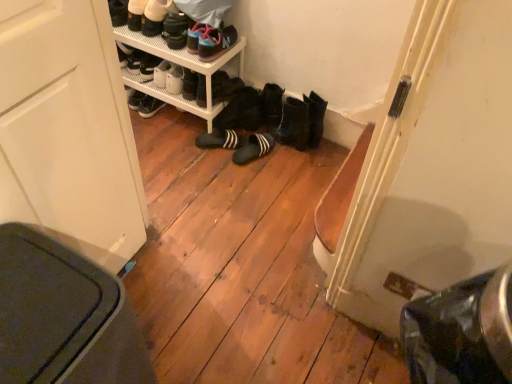
I want to click on matte black shoes at center, marked as the 4th footwear in a top-to-bottom arrangement, so click(x=174, y=80).

At what (x,y) coordinates should I click in order to perform the action: click on matte black shoes at upper center, the 2th footwear from the top. Please return your answer as a coordinate pair (x, y). Image resolution: width=512 pixels, height=384 pixels. Looking at the image, I should click on (176, 30).

Locate an element on the screen. The width and height of the screenshot is (512, 384). white plastic shelf at upper center is located at coordinates (182, 66).

Locate an element on the screen. The height and width of the screenshot is (384, 512). black suede slippers at center, arranged as the 7th footwear when viewed from the top is located at coordinates (253, 148).

Identify the location of black suede slippers at center, marked as the 6th footwear in a top-to-bottom arrangement. The width and height of the screenshot is (512, 384). (220, 140).

What is the approximate height of black rubber boots at center, the third footwear positioned from the bottom?

8.55 inches.

Find the location of a particular element. matte black sneakers at upper center, marked as the 5th footwear in a bottom-to-top arrangement is located at coordinates (216, 42).

Is point (167, 45) positioned after point (215, 139)?

No, (167, 45) is in front of (215, 139).

Considering the sizes of matte black shoes at upper center, the 2th footwear from the top, and black suede slippers at center, marked as the 6th footwear in a top-to-bottom arrangement, in the image, is matte black shoes at upper center, the 2th footwear from the top, bigger or smaller than black suede slippers at center, marked as the 6th footwear in a top-to-bottom arrangement,?

Clearly, matte black shoes at upper center, the 2th footwear from the top, is smaller in size than black suede slippers at center, marked as the 6th footwear in a top-to-bottom arrangement.

From the black suede slippers at center, marked as the 6th footwear in a top-to-bottom arrangement, count the 1st footwear to the left and point to it. Please provide its 2D coordinates.

[(176, 30)]

Which is in front, matte black sneakers at upper center, marked as the 5th footwear in a bottom-to-top arrangement, or white leather shoes at upper left, which is counted as the seventh footwear, starting from the bottom?

matte black sneakers at upper center, marked as the 5th footwear in a bottom-to-top arrangement.

From the image's perspective, is matte black sneakers at upper center, marked as the 5th footwear in a bottom-to-top arrangement, located beneath white leather shoes at upper left, which ranks as the first footwear in top-to-bottom order?

Correct, matte black sneakers at upper center, marked as the 5th footwear in a bottom-to-top arrangement, appears lower than white leather shoes at upper left, which ranks as the first footwear in top-to-bottom order, in the image.

Considering the points (208, 39) and (155, 29), which point is in front, point (208, 39) or point (155, 29)?

The point (208, 39) is in front.

Would you say black suede slippers at center, marked as the 6th footwear in a top-to-bottom arrangement, contains black suede slippers at center, placed as the 1th footwear when sorted from bottom to top?

Actually, black suede slippers at center, placed as the 1th footwear when sorted from bottom to top, is outside black suede slippers at center, marked as the 6th footwear in a top-to-bottom arrangement.

From a real-world perspective, which is physically above, black suede slippers at center, marked as the 6th footwear in a top-to-bottom arrangement, or black suede slippers at center, arranged as the 7th footwear when viewed from the top?

In real-world perspective, black suede slippers at center, marked as the 6th footwear in a top-to-bottom arrangement, is above.

Is black suede slippers at center, arranged as the 7th footwear when viewed from the top, at the back of black suede slippers at center, the second footwear positioned from the bottom?

black suede slippers at center, the second footwear positioned from the bottom, is not turned away from black suede slippers at center, arranged as the 7th footwear when viewed from the top.

In the scene shown: How different are the orientations of black suede slippers at center, marked as the 6th footwear in a top-to-bottom arrangement, and black suede slippers at center, placed as the 1th footwear when sorted from bottom to top, in degrees?

The angle between the facing direction of black suede slippers at center, marked as the 6th footwear in a top-to-bottom arrangement, and the facing direction of black suede slippers at center, placed as the 1th footwear when sorted from bottom to top, is 34.6 degrees.

Looking at this image, who is smaller, matte black shoes at center, marked as the 4th footwear in a top-to-bottom arrangement, or black rubber boots at center, arranged as the 5th footwear when viewed from the top?

Smaller between the two is matte black shoes at center, marked as the 4th footwear in a top-to-bottom arrangement.

Is matte black shoes at center, arranged as the fourth footwear when ordered from the bottom, next to black rubber boots at center, the third footwear positioned from the bottom?

No, matte black shoes at center, arranged as the fourth footwear when ordered from the bottom, is not next to black rubber boots at center, the third footwear positioned from the bottom.

Considering the positions of objects matte black shoes at center, marked as the 4th footwear in a top-to-bottom arrangement, and black rubber boots at center, the third footwear positioned from the bottom, in the image provided, who is behind, matte black shoes at center, marked as the 4th footwear in a top-to-bottom arrangement, or black rubber boots at center, the third footwear positioned from the bottom,?

matte black shoes at center, marked as the 4th footwear in a top-to-bottom arrangement, is more distant.

Looking at their sizes, would you say matte black shoes at center, arranged as the fourth footwear when ordered from the bottom, is wider or thinner than black rubber boots at center, arranged as the 5th footwear when viewed from the top?

Considering their sizes, matte black shoes at center, arranged as the fourth footwear when ordered from the bottom, looks slimmer than black rubber boots at center, arranged as the 5th footwear when viewed from the top.

Can you confirm if black rubber boots at center, arranged as the 5th footwear when viewed from the top, is shorter than white plastic shelf at upper center?

Indeed, black rubber boots at center, arranged as the 5th footwear when viewed from the top, has a lesser height compared to white plastic shelf at upper center.

Considering the relative sizes of black rubber boots at center, the third footwear positioned from the bottom, and white plastic shelf at upper center in the image provided, is black rubber boots at center, the third footwear positioned from the bottom, smaller than white plastic shelf at upper center?

Correct, black rubber boots at center, the third footwear positioned from the bottom, occupies less space than white plastic shelf at upper center.

Is black rubber boots at center, the third footwear positioned from the bottom, spatially inside white plastic shelf at upper center, or outside of it?

black rubber boots at center, the third footwear positioned from the bottom, exists outside the volume of white plastic shelf at upper center.

Identify the location of the 1st footwear directly beneath the white plastic shelf at upper center (from a real-world perspective). This screenshot has height=384, width=512. (241, 111).

How many degrees apart are the facing directions of black suede slippers at center, placed as the 1th footwear when sorted from bottom to top, and matte black shoes at upper center, which is the 6th footwear from bottom to top?

They differ by 63.9 degrees in their facing directions.

You are a GUI agent. You are given a task and a screenshot of the screen. Output one action in this format:
    pyautogui.click(x=<x>, y=<y>)
    Task: Click on the 4th footwear positioned above the black suede slippers at center, placed as the 1th footwear when sorted from bottom to top (from a real-world perspective)
    Image resolution: width=512 pixels, height=384 pixels.
    Given the screenshot: What is the action you would take?
    pyautogui.click(x=176, y=30)

Is black suede slippers at center, arranged as the 7th footwear when viewed from the top, aimed at matte black shoes at upper center, the 2th footwear from the top?

No, black suede slippers at center, arranged as the 7th footwear when viewed from the top, is not oriented towards matte black shoes at upper center, the 2th footwear from the top.

Who is smaller, black suede slippers at center, arranged as the 7th footwear when viewed from the top, or matte black shoes at upper center, the 2th footwear from the top?

Smaller between the two is matte black shoes at upper center, the 2th footwear from the top.

Considering the relative positions of black rubber boots at center, arranged as the 5th footwear when viewed from the top, and matte black sneakers at upper center, the 3th footwear from the top, in the image provided, is black rubber boots at center, arranged as the 5th footwear when viewed from the top, to the right of matte black sneakers at upper center, the 3th footwear from the top, from the viewer's perspective?

Yes, black rubber boots at center, arranged as the 5th footwear when viewed from the top, is to the right of matte black sneakers at upper center, the 3th footwear from the top.

Are black rubber boots at center, the third footwear positioned from the bottom, and matte black sneakers at upper center, marked as the 5th footwear in a bottom-to-top arrangement, beside each other?

black rubber boots at center, the third footwear positioned from the bottom, and matte black sneakers at upper center, marked as the 5th footwear in a bottom-to-top arrangement, are clearly separated.

Based on the photo, which of these two, black rubber boots at center, the third footwear positioned from the bottom, or matte black sneakers at upper center, marked as the 5th footwear in a bottom-to-top arrangement, stands shorter?

With less height is matte black sneakers at upper center, marked as the 5th footwear in a bottom-to-top arrangement.

Where is `the 4th footwear behind the matte black shoes at upper center, the 2th footwear from the top`? The image size is (512, 384). the 4th footwear behind the matte black shoes at upper center, the 2th footwear from the top is located at coordinates (220, 140).

At what (x,y) coordinates should I click in order to perform the action: click on the 4th footwear to the right when counting from the white leather shoes at upper left, which ranks as the first footwear in top-to-bottom order. Please return your answer as a coordinate pair (x, y). This screenshot has height=384, width=512. Looking at the image, I should click on (216, 42).

Estimate the real-world distances between objects in this image. Which object is further from matte black sneakers at upper center, the 3th footwear from the top, black suede slippers at center, marked as the 6th footwear in a top-to-bottom arrangement, or white plastic shelf at upper center?

black suede slippers at center, marked as the 6th footwear in a top-to-bottom arrangement.

From the image, which object appears to be nearer to white plastic shelf at upper center, matte black sneakers at upper center, marked as the 5th footwear in a bottom-to-top arrangement, or matte black shoes at center, marked as the 4th footwear in a top-to-bottom arrangement?

matte black shoes at center, marked as the 4th footwear in a top-to-bottom arrangement, is closer to white plastic shelf at upper center.

Which object lies further to the anchor point white leather shoes at upper left, which is counted as the seventh footwear, starting from the bottom, matte black shoes at center, marked as the 4th footwear in a top-to-bottom arrangement, or matte black shoes at upper center, the 2th footwear from the top?

matte black shoes at center, marked as the 4th footwear in a top-to-bottom arrangement, lies further to white leather shoes at upper left, which is counted as the seventh footwear, starting from the bottom, than the other object.

Considering their positions, is black suede slippers at center, placed as the 1th footwear when sorted from bottom to top, positioned further to white plastic shelf at upper center than black rubber boots at center, the third footwear positioned from the bottom?

black suede slippers at center, placed as the 1th footwear when sorted from bottom to top, is positioned further to the anchor white plastic shelf at upper center.

When comparing their distances from black rubber boots at center, the third footwear positioned from the bottom, does black suede slippers at center, placed as the 1th footwear when sorted from bottom to top, or white plastic shelf at upper center seem closer?

The object closer to black rubber boots at center, the third footwear positioned from the bottom, is black suede slippers at center, placed as the 1th footwear when sorted from bottom to top.

Looking at the image, which one is located further to matte black shoes at center, arranged as the fourth footwear when ordered from the bottom, black suede slippers at center, arranged as the 7th footwear when viewed from the top, or black rubber boots at center, the third footwear positioned from the bottom?

The object further to matte black shoes at center, arranged as the fourth footwear when ordered from the bottom, is black suede slippers at center, arranged as the 7th footwear when viewed from the top.

Estimate the real-world distances between objects in this image. Which object is further from black rubber boots at center, the third footwear positioned from the bottom, black suede slippers at center, placed as the 1th footwear when sorted from bottom to top, or white leather shoes at upper left, which ranks as the first footwear in top-to-bottom order?

white leather shoes at upper left, which ranks as the first footwear in top-to-bottom order, is further to black rubber boots at center, the third footwear positioned from the bottom.

Based on their spatial positions, is black rubber boots at center, arranged as the 5th footwear when viewed from the top, or black suede slippers at center, placed as the 1th footwear when sorted from bottom to top, further from white leather shoes at upper left, which ranks as the first footwear in top-to-bottom order?

Among the two, black suede slippers at center, placed as the 1th footwear when sorted from bottom to top, is located further to white leather shoes at upper left, which ranks as the first footwear in top-to-bottom order.

Identify the location of shelf between white leather shoes at upper left, which is counted as the seventh footwear, starting from the bottom, and black suede slippers at center, marked as the 6th footwear in a top-to-bottom arrangement, from top to bottom. (182, 66).

Locate an element on the screen. The image size is (512, 384). shelf that lies between matte black shoes at upper center, the 2th footwear from the top, and black suede slippers at center, marked as the 6th footwear in a top-to-bottom arrangement, from top to bottom is located at coordinates (182, 66).

Identify the location of shelf between matte black sneakers at upper center, marked as the 5th footwear in a bottom-to-top arrangement, and black suede slippers at center, marked as the 6th footwear in a top-to-bottom arrangement, in the vertical direction. The width and height of the screenshot is (512, 384). (182, 66).

What are the coordinates of `shelf between white leather shoes at upper left, which is counted as the seventh footwear, starting from the bottom, and black suede slippers at center, placed as the 1th footwear when sorted from bottom to top, in the up-down direction` in the screenshot? It's located at (182, 66).